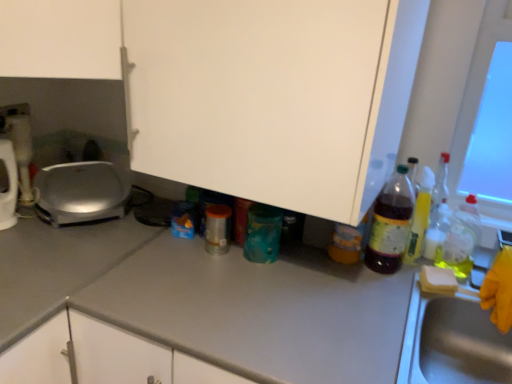
What are the coordinates of `vacant space to the right of translucent plastic bottle at right, which is the 3th bottle from right to left` in the screenshot? It's located at (429, 276).